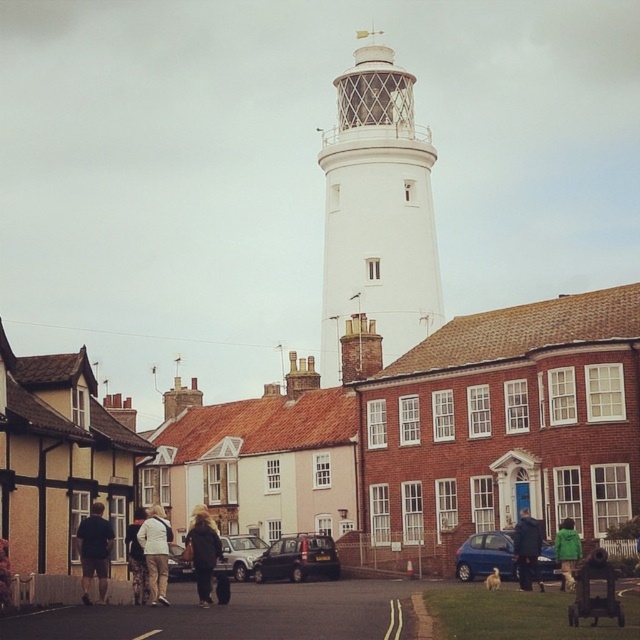
Question: Which object appears farthest from the camera in this image?

Choices:
 (A) white matte lighthouse at center
 (B) dark gray shorts at lower left
 (C) dark gray metallic hatchback at center
 (D) dark blue jacket at lower right

Answer: (A)

Question: Which object is farther from the camera taking this photo?

Choices:
 (A) blue metallic car at lower center
 (B) white matte lighthouse at center

Answer: (B)

Question: Does dark gray shorts at lower left appear on the right side of light beige pants at center?

Choices:
 (A) yes
 (B) no

Answer: (A)

Question: Which of the following is the closest to the observer?

Choices:
 (A) green matte jacket at lower right
 (B) light brown leather jacket at center
 (C) dark gray metallic hatchback at center
 (D) dark blue jacket at lower right

Answer: (B)

Question: Can you confirm if light beige pants at center is smaller than light brown leather jacket at center?

Choices:
 (A) no
 (B) yes

Answer: (A)

Question: Where is dark brown leather jacket at lower center located in relation to dark blue jacket at lower right in the image?

Choices:
 (A) left
 (B) right

Answer: (A)